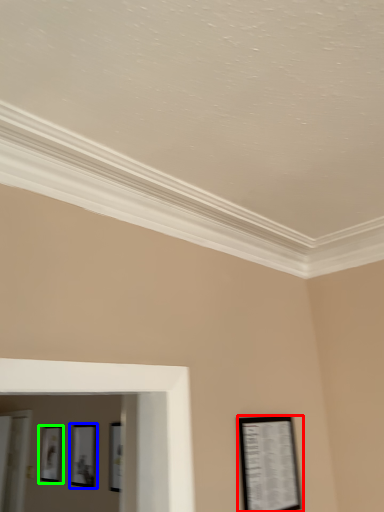
Question: Which object is the farthest from picture frame (highlighted by a red box)? Choose among these: picture frame (highlighted by a blue box) or picture frame (highlighted by a green box).

Choices:
 (A) picture frame
 (B) picture frame

Answer: (B)